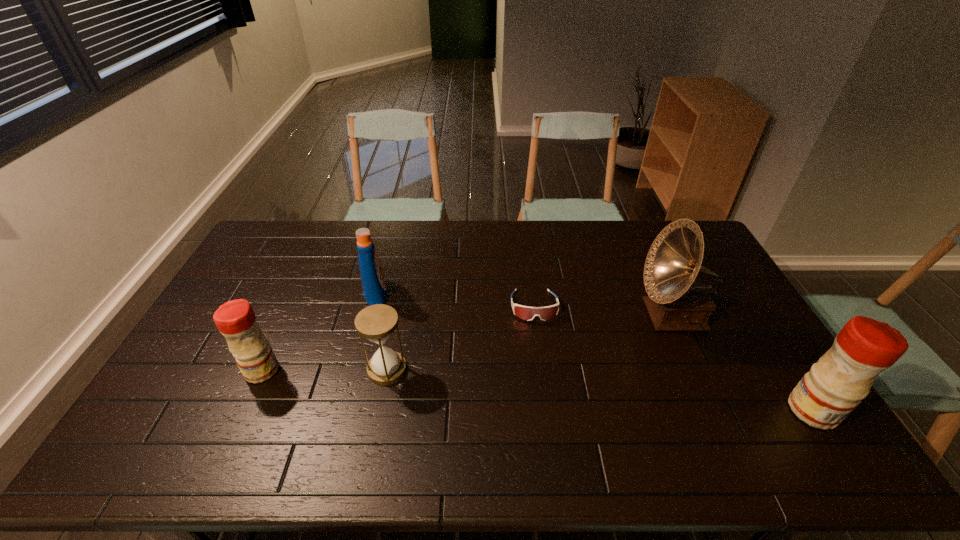
The image size is (960, 540). I want to click on vacant position for inserting another condiment evenly, so click(526, 389).